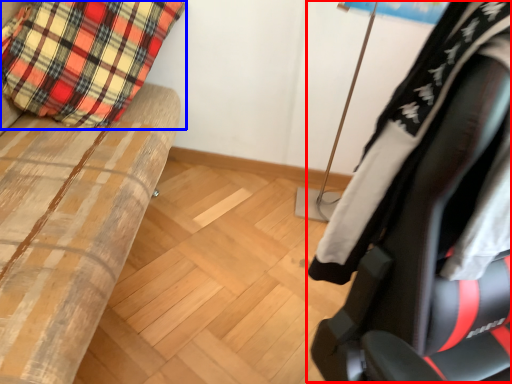
Question: Which object is closer to the camera taking this photo, chair (highlighted by a red box) or pillow (highlighted by a blue box)?

Choices:
 (A) chair
 (B) pillow

Answer: (A)